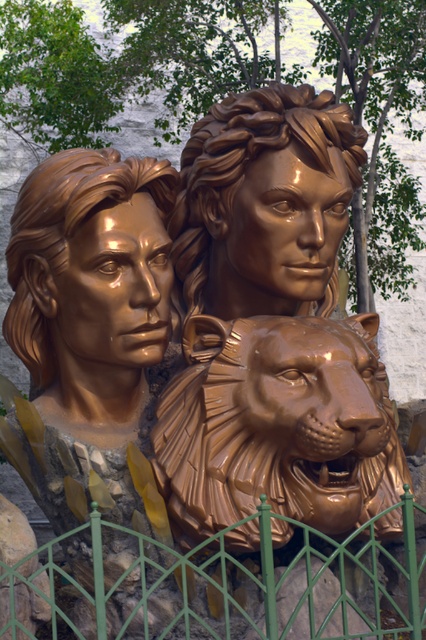
You are an art conservator examining the sculpture. You need to determine if the shiny bronze lion at center can be moved to a new display case that can only accommodate objects up to the width of the shiny bronze face at center. Based on the sculpture, can the lion fit in the case?

The shiny bronze lion at center might be wider than shiny bronze face at center, so it is uncertain if it will fit. Further measurements are needed.

You are an art conservator examining the bronze sculpture. You notice two points on the sculpture marked at coordinates point (198, 273) and point (55, 330). Which point is closer to the front of the sculpture?

Point (198, 273) is further to the camera than point (55, 330), so point (55, 330) is closer to the front of the sculpture.